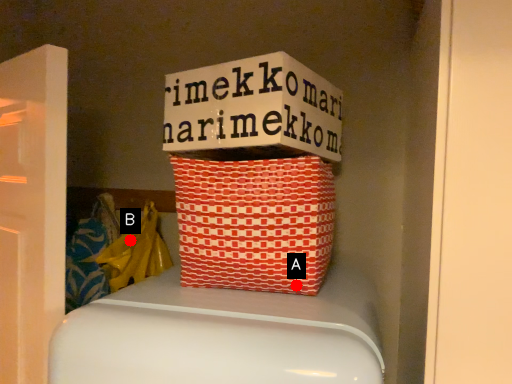
Question: Two points are circled on the image, labeled by A and B beside each circle. Which point appears closest to the camera in this image?

Choices:
 (A) A is closer
 (B) B is closer

Answer: (A)